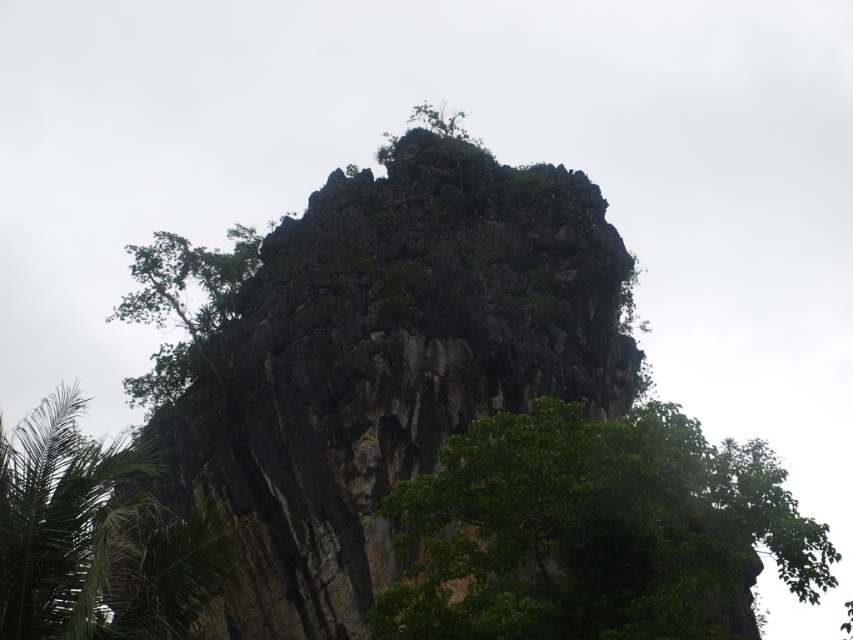
Question: Which object is closer to the camera taking this photo?

Choices:
 (A) green leafy tree at upper left
 (B) dark rock formation at center
 (C) green leafy palm tree at lower left

Answer: (C)

Question: From the image, what is the correct spatial relationship of dark rock formation at center in relation to green leafy tree at upper left?

Choices:
 (A) right
 (B) left

Answer: (A)

Question: Can you confirm if dark rock formation at center is smaller than green leafy palm tree at lower left?

Choices:
 (A) yes
 (B) no

Answer: (A)

Question: Does dark rock formation at center lie in front of green leafy tree at center?

Choices:
 (A) no
 (B) yes

Answer: (A)

Question: Estimate the real-world distances between objects in this image. Which object is farther from the dark rock formation at center?

Choices:
 (A) green leafy tree at center
 (B) green leafy palm tree at lower left

Answer: (B)

Question: Which point is closer to the camera?

Choices:
 (A) green leafy palm tree at lower left
 (B) green leafy tree at upper left
 (C) dark rock formation at center

Answer: (A)